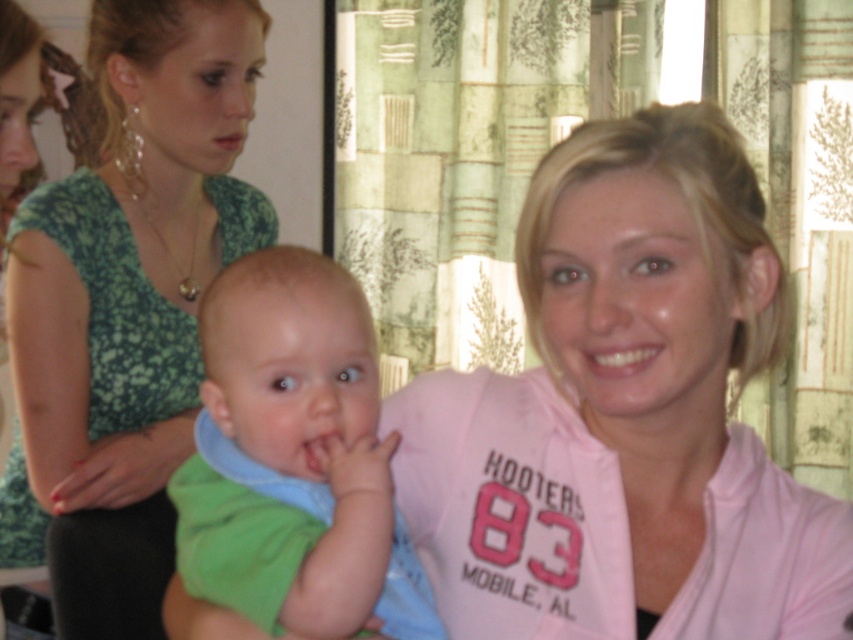
Question: Can you confirm if green floral dress at upper left is smaller than green soft fabric baby at center?

Choices:
 (A) no
 (B) yes

Answer: (A)

Question: Which point is farther to the camera?

Choices:
 (A) green soft fabric baby at center
 (B) green floral dress at upper left

Answer: (B)

Question: Can you confirm if green floral dress at upper left is wider than green soft fabric baby at center?

Choices:
 (A) no
 (B) yes

Answer: (B)

Question: Does green floral dress at upper left come in front of green soft fabric baby at center?

Choices:
 (A) yes
 (B) no

Answer: (B)

Question: Which point is farther to the camera?

Choices:
 (A) (138, 8)
 (B) (296, 253)

Answer: (A)